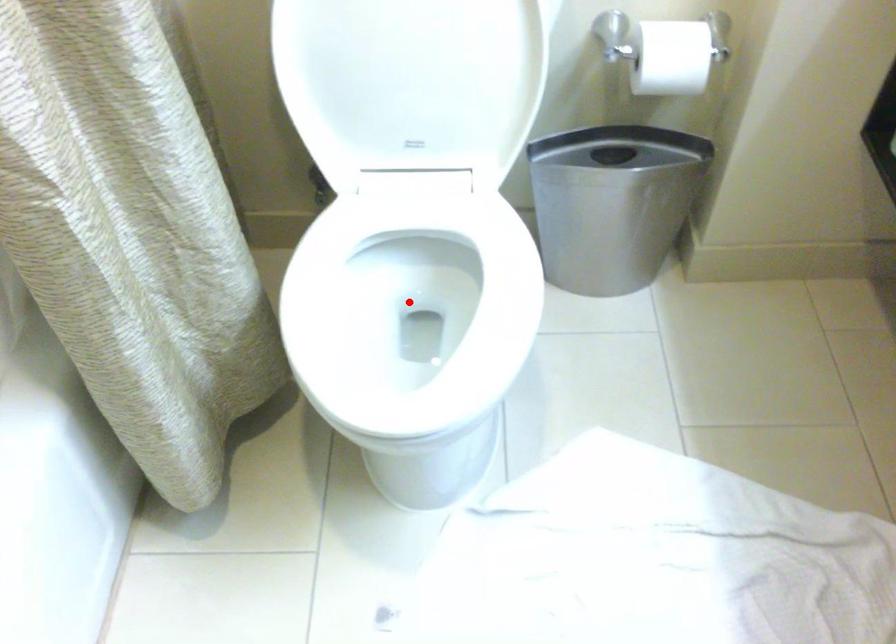
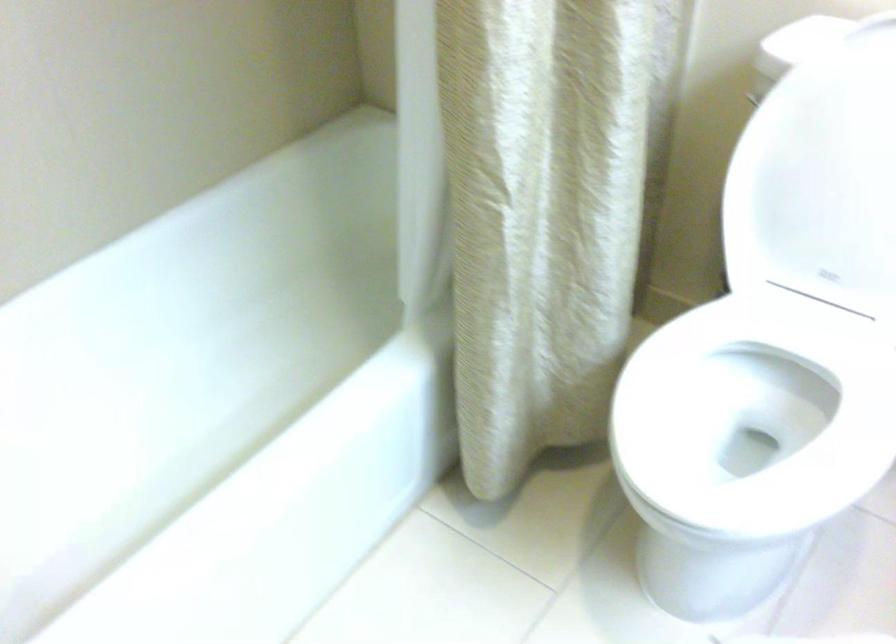
Where in the second image is the point corresponding to the highlighted location from the first image?

(752, 420)